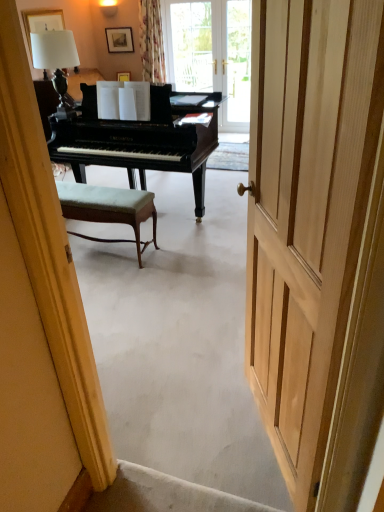
Locate an element on the screen. The image size is (384, 512). vacant space underneath green fabric bench at center (from a real-world perspective) is located at coordinates (105, 250).